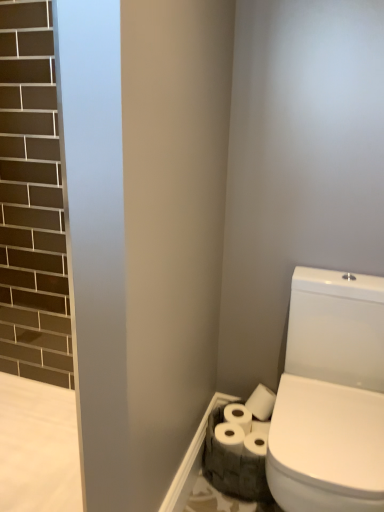
Question: Is white matte toilet paper at lower right, positioned as the second toilet paper in back-to-front order, positioned before white matte toilet paper at lower right, which is counted as the 1th toilet paper, starting from the back?

Choices:
 (A) no
 (B) yes

Answer: (B)

Question: Does white matte toilet paper at lower right, positioned as the second toilet paper in back-to-front order, have a greater height compared to white matte toilet paper at lower right, which is counted as the 1th toilet paper, starting from the back?

Choices:
 (A) yes
 (B) no

Answer: (B)

Question: Is white matte toilet paper at lower right, the first toilet paper when ordered from front to back, smaller than white matte toilet paper at lower right, which is counted as the 1th toilet paper, starting from the back?

Choices:
 (A) no
 (B) yes

Answer: (A)

Question: From a real-world perspective, is white matte toilet paper at lower right, the first toilet paper when ordered from front to back, on white matte toilet paper at lower right, which is counted as the 1th toilet paper, starting from the back?

Choices:
 (A) yes
 (B) no

Answer: (B)

Question: Can you confirm if white matte toilet paper at lower right, the first toilet paper when ordered from front to back, is positioned to the left of white matte toilet paper at lower right, the 2th toilet paper positioned from the front?

Choices:
 (A) yes
 (B) no

Answer: (A)

Question: From the image's perspective, would you say white matte toilet paper at lower right, the first toilet paper when ordered from front to back, is shown under white matte toilet paper at lower right, the 2th toilet paper positioned from the front?

Choices:
 (A) yes
 (B) no

Answer: (A)

Question: Can we say white matte toilet paper at lower right, which is counted as the 1th toilet paper, starting from the back, lies outside white matte toilet paper at lower right, positioned as the second toilet paper in back-to-front order?

Choices:
 (A) yes
 (B) no

Answer: (A)

Question: From the image's perspective, is white matte toilet paper at lower right, which is counted as the 1th toilet paper, starting from the back, on white matte toilet paper at lower right, the first toilet paper when ordered from front to back?

Choices:
 (A) no
 (B) yes

Answer: (B)

Question: Does white matte toilet paper at lower right, the 2th toilet paper positioned from the front, contain white matte toilet paper at lower right, positioned as the second toilet paper in back-to-front order?

Choices:
 (A) no
 (B) yes

Answer: (A)

Question: Is white matte toilet paper at lower right, which is counted as the 1th toilet paper, starting from the back, shorter than white matte toilet paper at lower right, the first toilet paper when ordered from front to back?

Choices:
 (A) yes
 (B) no

Answer: (B)

Question: Does white matte toilet paper at lower right, which is counted as the 1th toilet paper, starting from the back, lie behind white matte toilet paper at lower right, positioned as the second toilet paper in back-to-front order?

Choices:
 (A) no
 (B) yes

Answer: (B)

Question: From a real-world perspective, is white matte toilet paper at lower right, which is counted as the 1th toilet paper, starting from the back, located higher than white matte toilet paper at lower right, the first toilet paper when ordered from front to back?

Choices:
 (A) no
 (B) yes

Answer: (B)

Question: From the image's perspective, is white matte toilet paper at lower right, the 2th toilet paper positioned from the front, located above or below white matte toilet paper at lower right, the first toilet paper when ordered from front to back?

Choices:
 (A) below
 (B) above

Answer: (B)